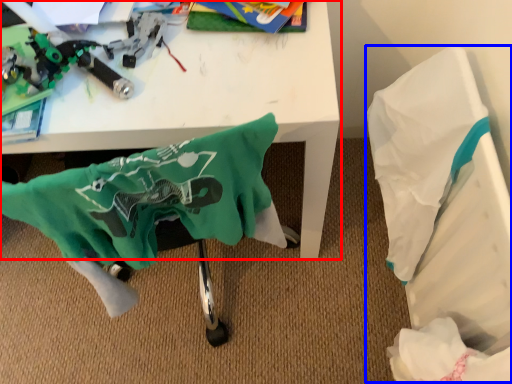
Question: Among these objects, which one is farthest to the camera, table (highlighted by a red box) or wrapping paper (highlighted by a blue box)?

Choices:
 (A) table
 (B) wrapping paper

Answer: (B)